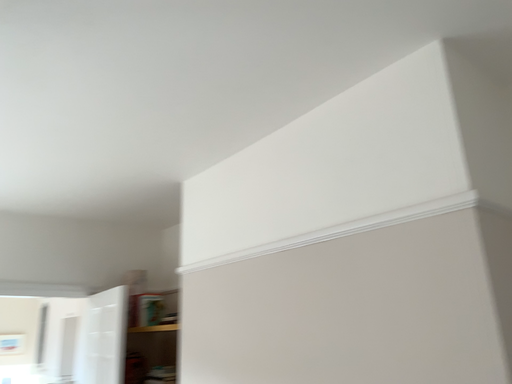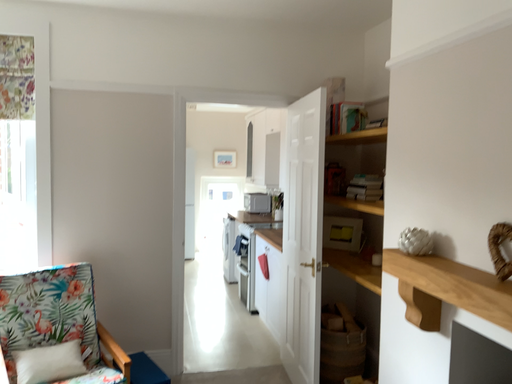
Question: How did the camera likely rotate when shooting the video?

Choices:
 (A) rotated right
 (B) rotated left

Answer: (B)